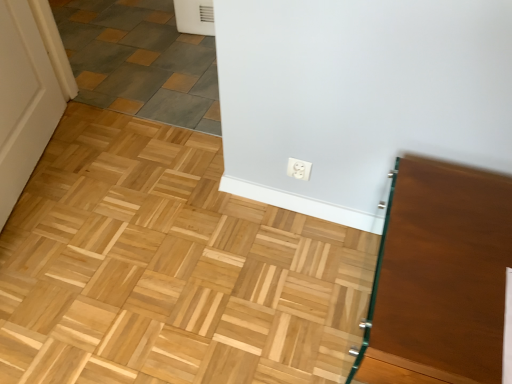
Question: From a real-world perspective, relative to brown glossy vanity at right, is gray slate tile at upper left vertically above or below?

Choices:
 (A) above
 (B) below

Answer: (B)

Question: Looking at the image, does gray slate tile at upper left seem bigger or smaller compared to brown glossy vanity at right?

Choices:
 (A) small
 (B) big

Answer: (B)

Question: Considering the real-world distances, which object is closest to the white plastic outlet at center?

Choices:
 (A) brown glossy vanity at right
 (B) gray slate tile at upper left

Answer: (A)

Question: Which of these objects is positioned closest to the brown glossy vanity at right?

Choices:
 (A) gray slate tile at upper left
 (B) white plastic outlet at center

Answer: (B)